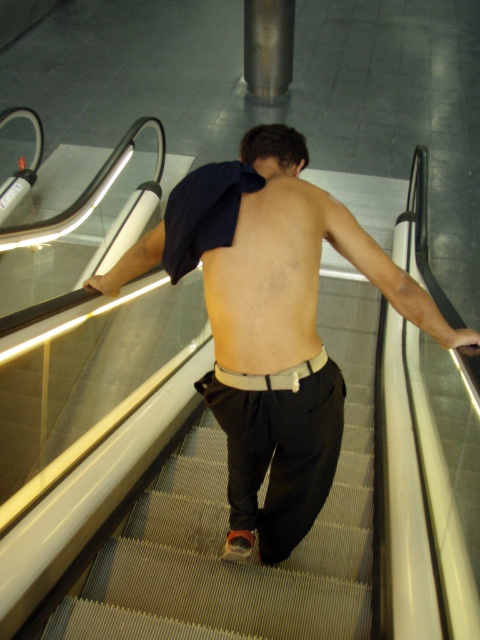
Who is higher up, matte black pants at center or skinny beige skin at back?

skinny beige skin at back is above.

Who is shorter, matte black pants at center or skinny beige skin at back?

skinny beige skin at back

Which is in front, point (295, 516) or point (256, 237)?

Point (256, 237) is more forward.

Identify the location of matte black pants at center. Image resolution: width=480 pixels, height=640 pixels. (271, 323).

Can you confirm if matte black pants at center is positioned above smooth gray stairs at center?

Yes, matte black pants at center is above smooth gray stairs at center.

Is matte black pants at center thinner than smooth gray stairs at center?

No, matte black pants at center is not thinner than smooth gray stairs at center.

The image size is (480, 640). What do you see at coordinates (271, 323) in the screenshot?
I see `matte black pants at center` at bounding box center [271, 323].

Where is `matte black pants at center`? This screenshot has height=640, width=480. matte black pants at center is located at coordinates (271, 323).

Does matte black pants at center have a lesser height compared to black cotton pants at center?

Incorrect, matte black pants at center's height does not fall short of black cotton pants at center's.

Is matte black pants at center to the left of black cotton pants at center from the viewer's perspective?

Yes, matte black pants at center is to the left of black cotton pants at center.

Consider the image. Who is more distant from viewer, [123,280] or [309,451]?

The point [123,280] is more distant.

Where is `matte black pants at center`? This screenshot has height=640, width=480. matte black pants at center is located at coordinates (271, 323).